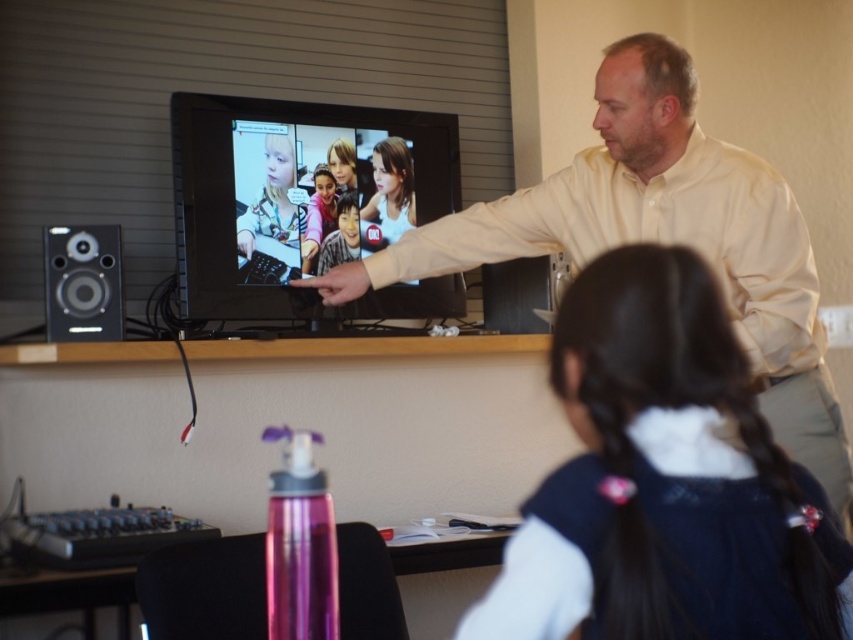
Between point (618, 493) and point (657, 237), which one is positioned in front?

Positioned in front is point (618, 493).

Between black silky hair at upper center and matte yellow shirt at upper right, which one has less height?

black silky hair at upper center

This screenshot has height=640, width=853. Describe the element at coordinates (664, 477) in the screenshot. I see `black silky hair at upper center` at that location.

Locate an element on the screen. This screenshot has width=853, height=640. black silky hair at upper center is located at coordinates (664, 477).

Between matte yellow shirt at upper right and matte black speaker at left, which one appears on the left side from the viewer's perspective?

From the viewer's perspective, matte black speaker at left appears more on the left side.

How far apart are matte yellow shirt at upper right and matte black speaker at left?

matte yellow shirt at upper right and matte black speaker at left are 36.90 inches apart from each other.

Which is in front, point (550, 248) or point (99, 324)?

Point (99, 324)

This screenshot has width=853, height=640. What are the coordinates of `matte yellow shirt at upper right` in the screenshot? It's located at (660, 237).

Does black silky hair at upper center appear on the left side of matte black speaker at left?

Incorrect, black silky hair at upper center is not on the left side of matte black speaker at left.

Who is higher up, black silky hair at upper center or matte black speaker at left?

matte black speaker at left

Between point (791, 588) and point (53, 228), which one is positioned in front?

Positioned in front is point (791, 588).

This screenshot has height=640, width=853. What are the coordinates of `black silky hair at upper center` in the screenshot? It's located at (664, 477).